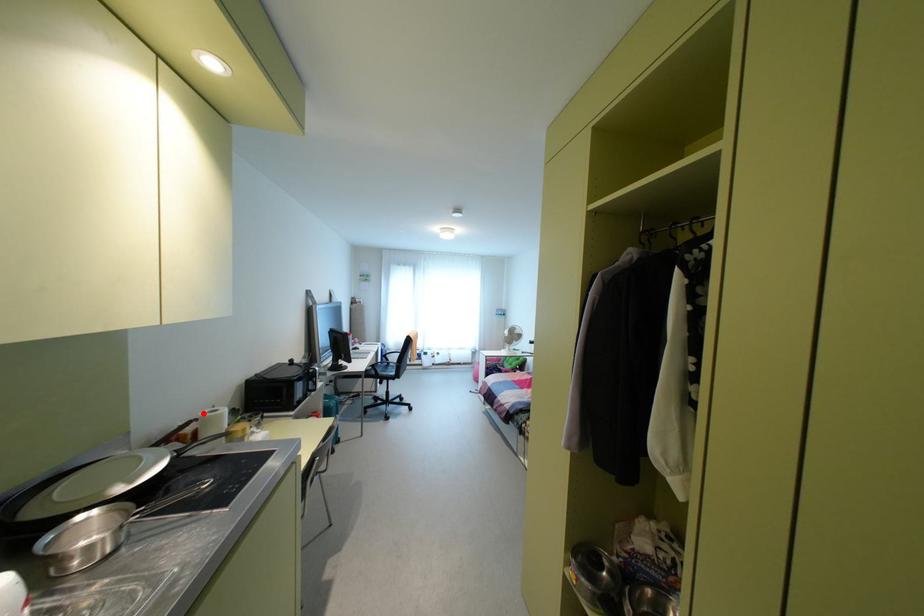
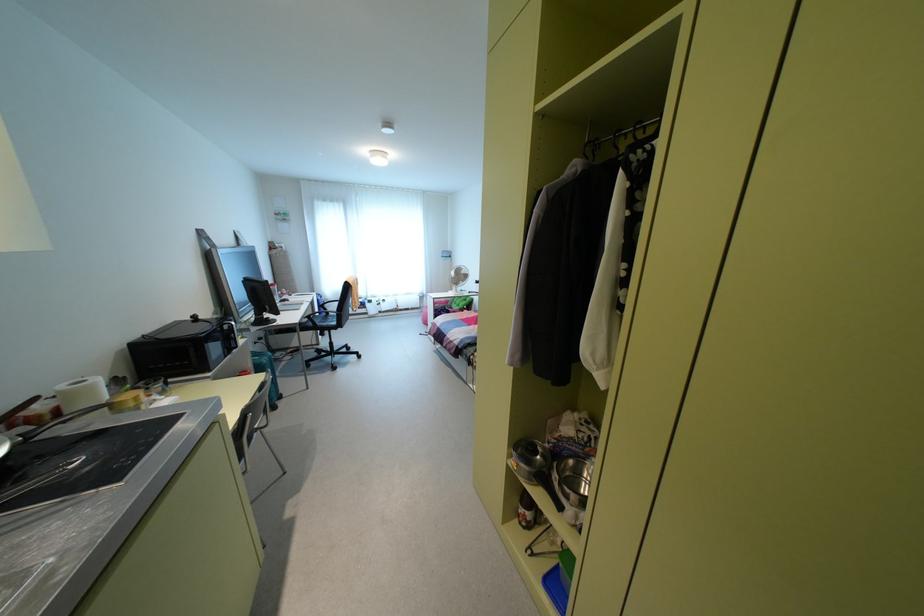
The point at the highlighted location is marked in the first image. Where is the corresponding point in the second image?

(62, 387)